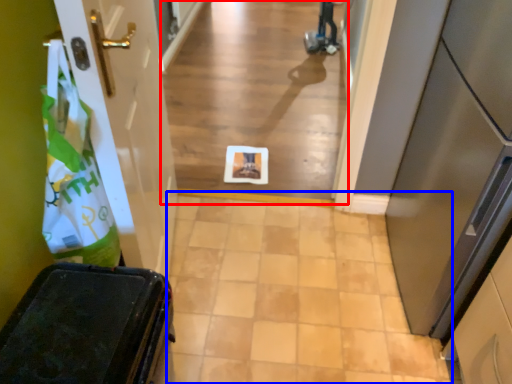
Question: Which point is further to the camera, alley (highlighted by a red box) or path (highlighted by a blue box)?

Choices:
 (A) alley
 (B) path

Answer: (A)